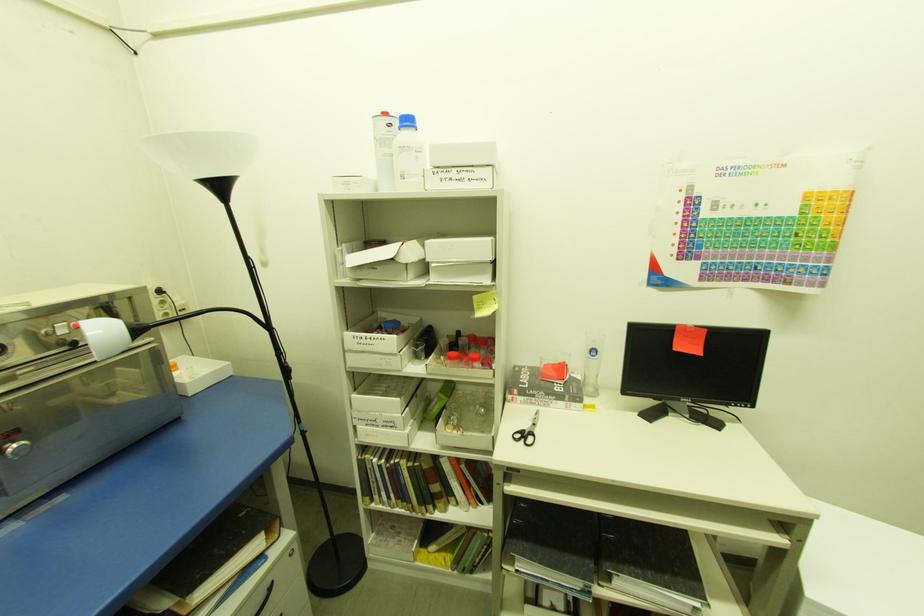
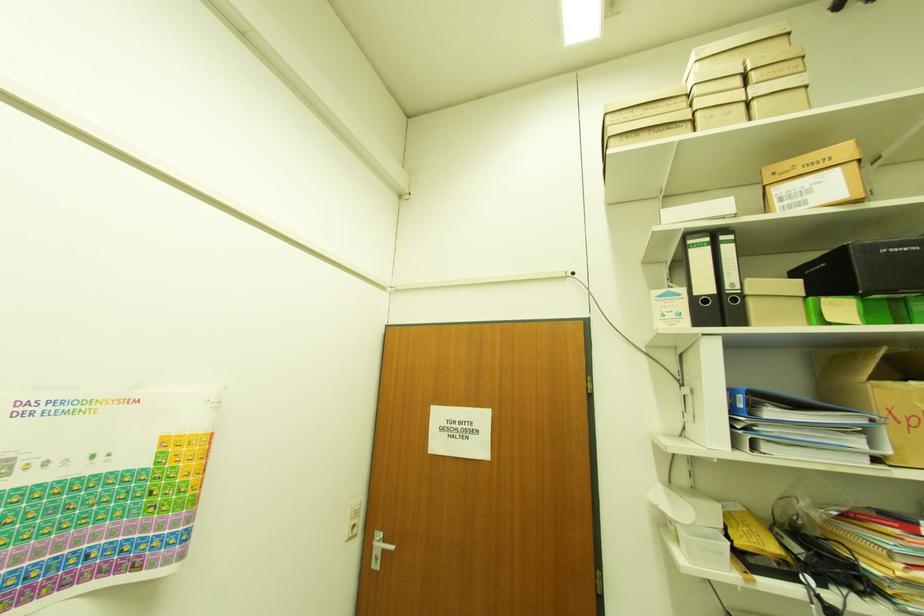
Based on the continuous images, in which direction is the camera rotating?

The camera's rotation is toward right-up.